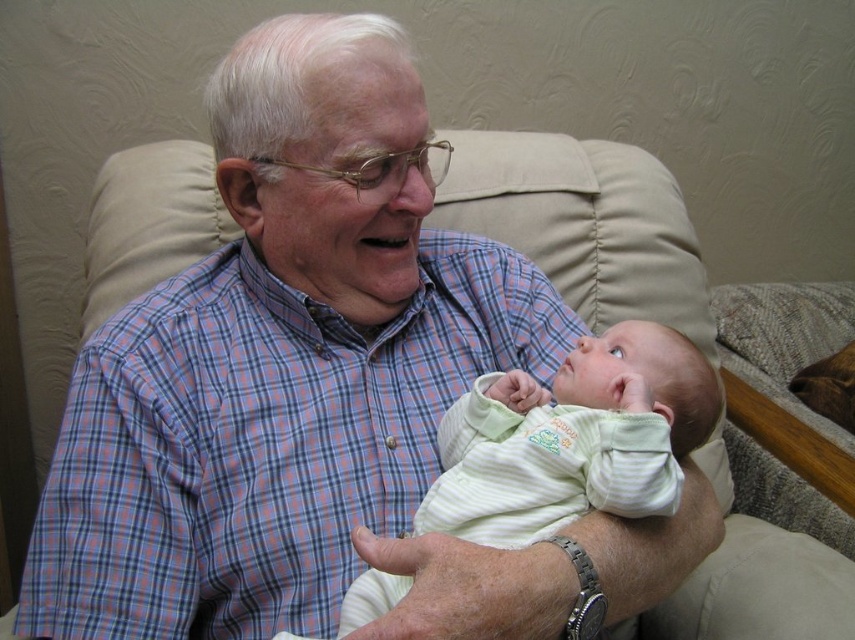
Does point (316, 586) lie behind point (647, 355)?

No, (316, 586) is in front of (647, 355).

Is plaid cotton shirt at center below light green striped fabric baby at center?

No, plaid cotton shirt at center is not below light green striped fabric baby at center.

What do you see at coordinates (261, 442) in the screenshot? The width and height of the screenshot is (855, 640). I see `plaid cotton shirt at center` at bounding box center [261, 442].

Where is `plaid cotton shirt at center`? The width and height of the screenshot is (855, 640). plaid cotton shirt at center is located at coordinates (261, 442).